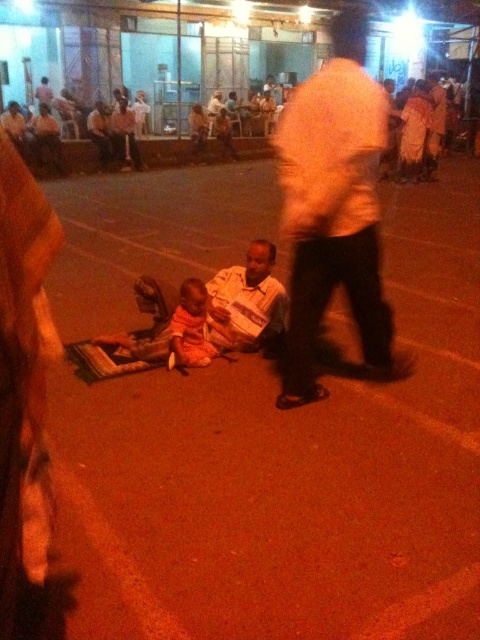
Is white matte shirt at center smaller than orange cotton baby at center?

No.

Identify the location of white matte shirt at center. Image resolution: width=480 pixels, height=640 pixels. (334, 208).

Where is `white matte shirt at center`? white matte shirt at center is located at coordinates (334, 208).

Is white striped shirt at center to the left of orange cotton baby at center from the viewer's perspective?

Incorrect, white striped shirt at center is not on the left side of orange cotton baby at center.

Which is behind, point (267, 307) or point (204, 348)?

Point (267, 307)

The image size is (480, 640). I want to click on white striped shirt at center, so click(250, 298).

Does white matte shirt at center appear on the right side of white striped shirt at center?

Correct, you'll find white matte shirt at center to the right of white striped shirt at center.

The image size is (480, 640). I want to click on white matte shirt at center, so pyautogui.click(x=334, y=208).

Where is `white matte shirt at center`? white matte shirt at center is located at coordinates (x=334, y=208).

Find the location of a particular element. The image size is (480, 640). white matte shirt at center is located at coordinates (334, 208).